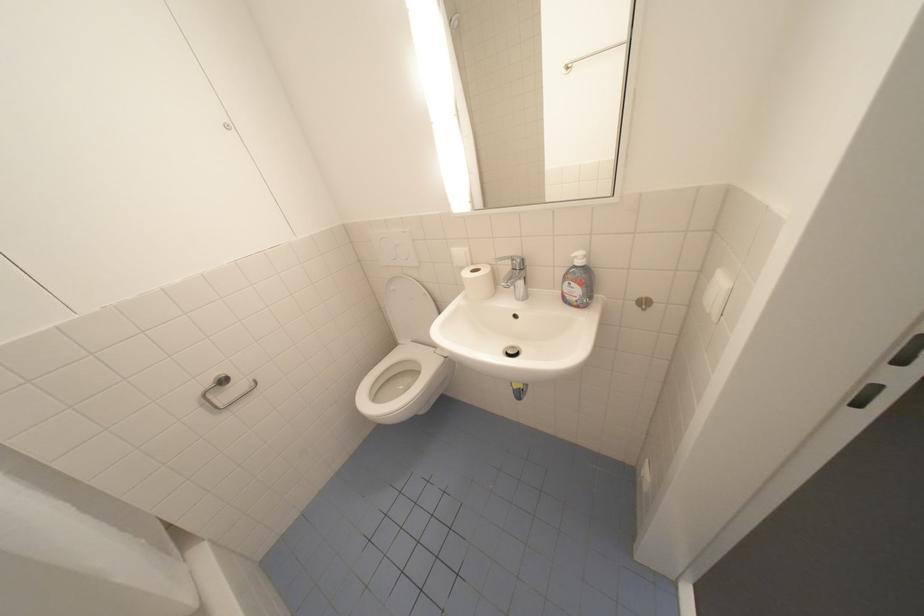
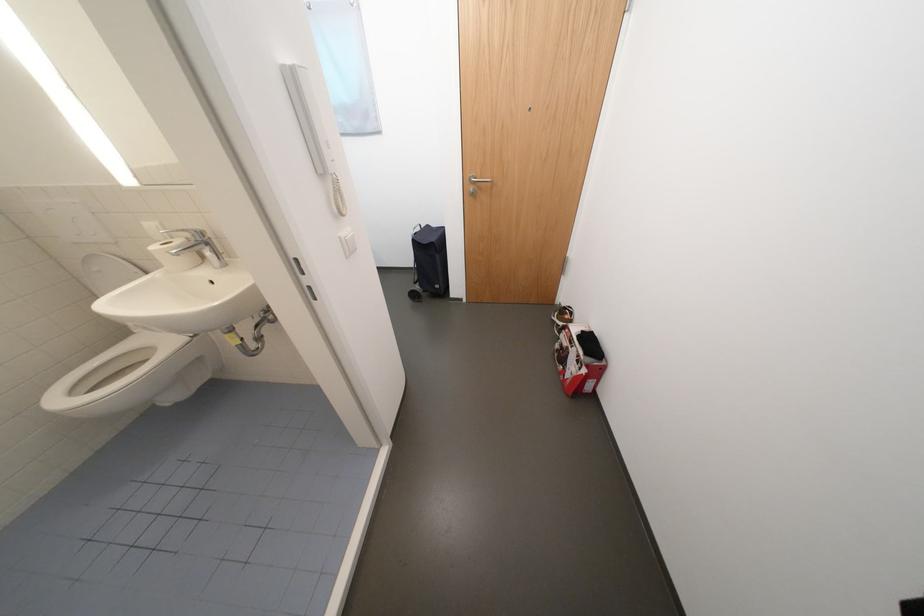
Question: The camera is either moving clockwise (left) or counter-clockwise (right) around the object. The first image is from the beginning of the video and the second image is from the end. Is the camera moving left or right when shooting the video?

Choices:
 (A) Left
 (B) Right

Answer: (A)